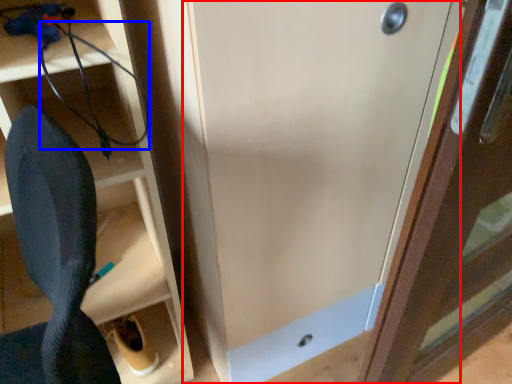
Question: Which object is further to the camera taking this photo, door (highlighted by a red box) or wire (highlighted by a blue box)?

Choices:
 (A) door
 (B) wire

Answer: (B)